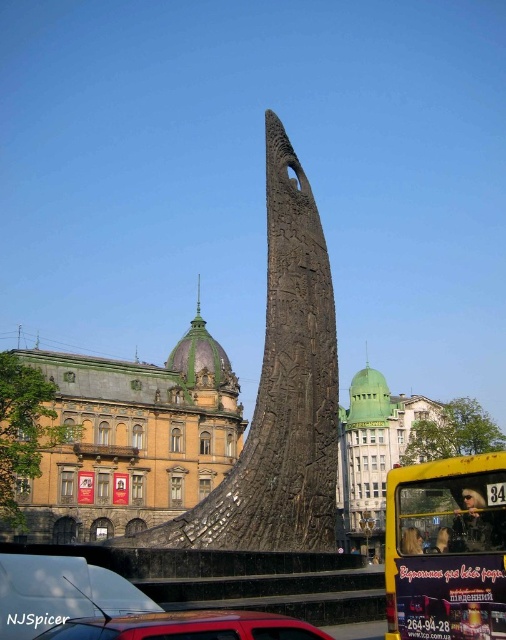
Question: Is black textured stone monument at center smaller than metallic red car at lower center?

Choices:
 (A) yes
 (B) no

Answer: (B)

Question: Is black textured stone monument at center smaller than metallic red car at lower center?

Choices:
 (A) no
 (B) yes

Answer: (A)

Question: Which object appears farthest from the camera in this image?

Choices:
 (A) metallic red car at lower left
 (B) black textured stone monument at center
 (C) yellow matte/decorative bus at lower right
 (D) metallic red car at lower center

Answer: (B)

Question: Which point is closer to the camera?

Choices:
 (A) yellow matte/decorative bus at lower right
 (B) black textured stone monument at center
 (C) metallic red car at lower left
 (D) metallic red car at lower center

Answer: (D)

Question: Where is metallic red car at lower left located in relation to metallic red car at lower center in the image?

Choices:
 (A) left
 (B) right

Answer: (A)

Question: Which of the following is the closest to the observer?

Choices:
 (A) (450, 538)
 (B) (321, 340)
 (C) (12, 621)
 (D) (296, 636)

Answer: (D)